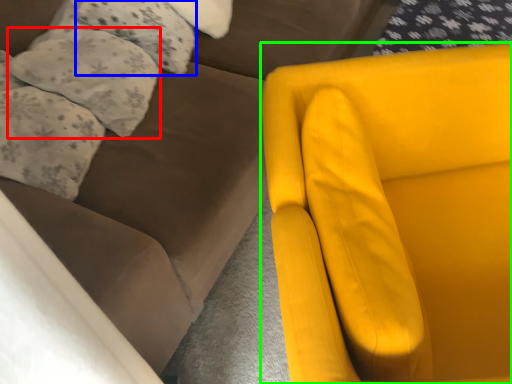
Question: Which object is positioned farthest from pillow (highlighted by a red box)? Select from pillow (highlighted by a blue box) and chair (highlighted by a green box).

Choices:
 (A) pillow
 (B) chair

Answer: (B)